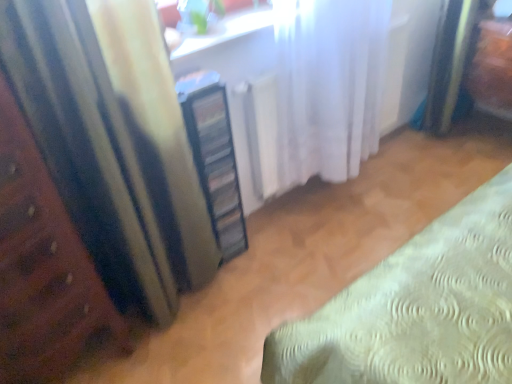
Where is `vacant region in front of matte yellow curtain at left, the second curtain viewed from the right`? vacant region in front of matte yellow curtain at left, the second curtain viewed from the right is located at coordinates (186, 353).